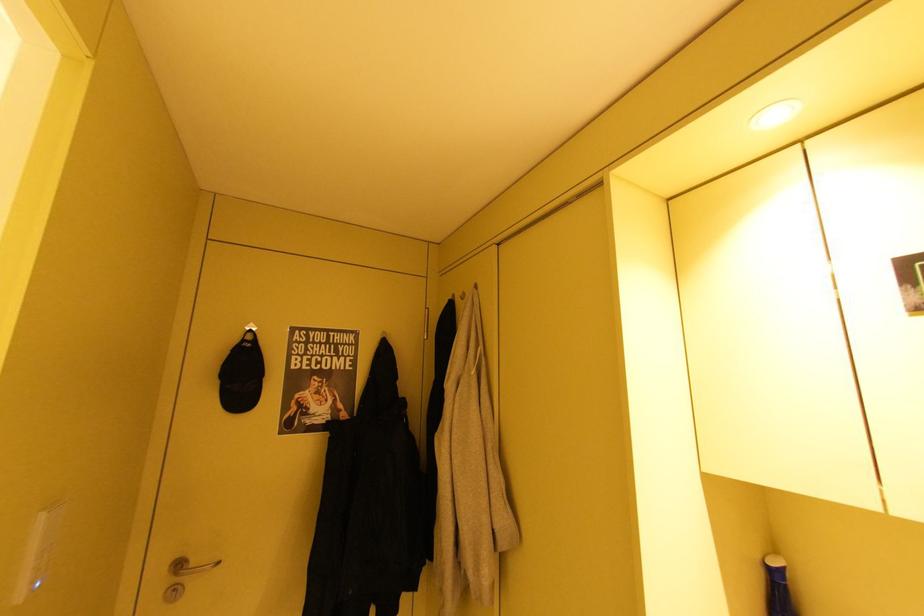
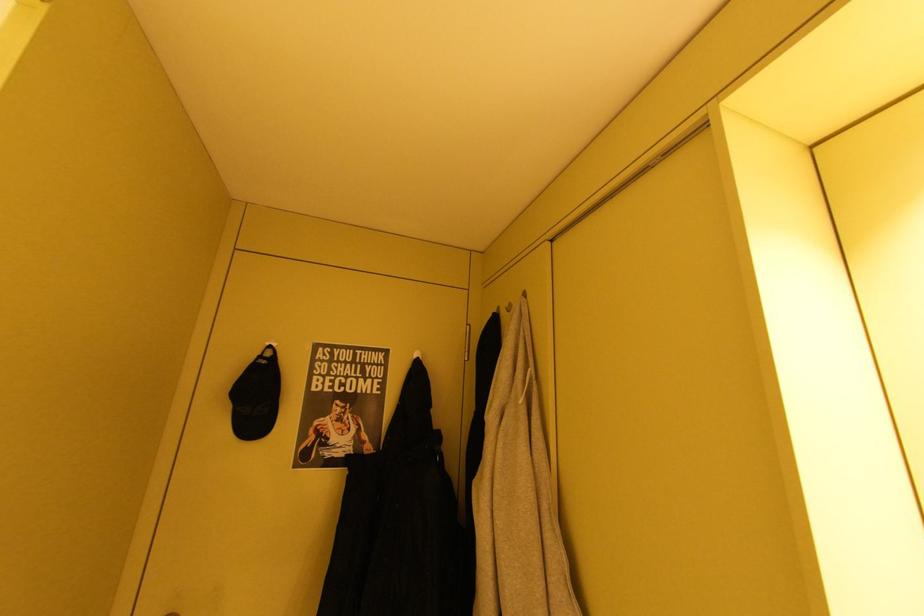
Question: In a continuous first-person perspective shot, in which direction is the camera moving?

Choices:
 (A) Left
 (B) Right
 (C) Forward
 (D) Backward

Answer: (C)